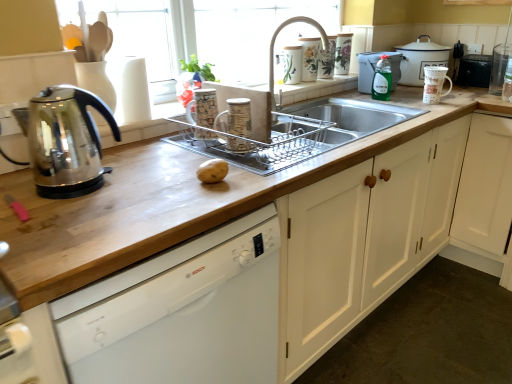
In order to click on free point in front of transparent glass kettle at left, the first kitchen appliance in the front-to-back sequence in this screenshot , I will do `click(66, 210)`.